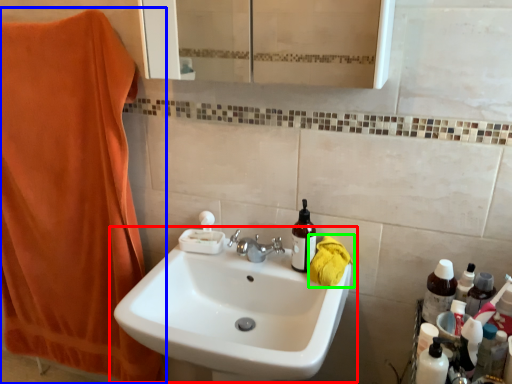
Question: Which is nearer to the sink (highlighted by a red box)? beach towel (highlighted by a blue box) or beach towel (highlighted by a green box).

Choices:
 (A) beach towel
 (B) beach towel

Answer: (B)